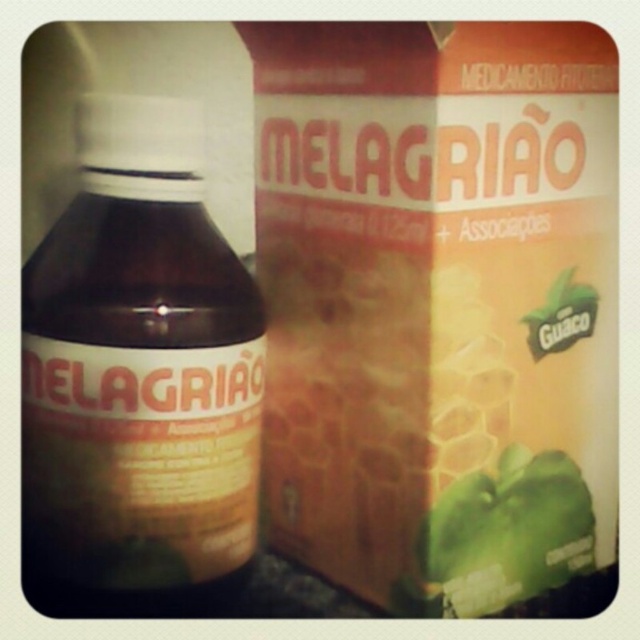
Question: Which is nearer to the matte brown box at center?

Choices:
 (A) green matte pepper at center
 (B) brown glass bottle at left

Answer: (A)

Question: Is brown glass bottle at left wider than green matte pepper at center?

Choices:
 (A) yes
 (B) no

Answer: (A)

Question: Is matte brown box at center wider than green matte pepper at center?

Choices:
 (A) no
 (B) yes

Answer: (B)

Question: Is matte brown box at center wider than brown glass bottle at left?

Choices:
 (A) yes
 (B) no

Answer: (A)

Question: Which object appears farthest from the camera in this image?

Choices:
 (A) matte brown box at center
 (B) green matte pepper at center

Answer: (B)

Question: Among these objects, which one is farthest from the camera?

Choices:
 (A) brown glass bottle at left
 (B) green matte pepper at center

Answer: (B)